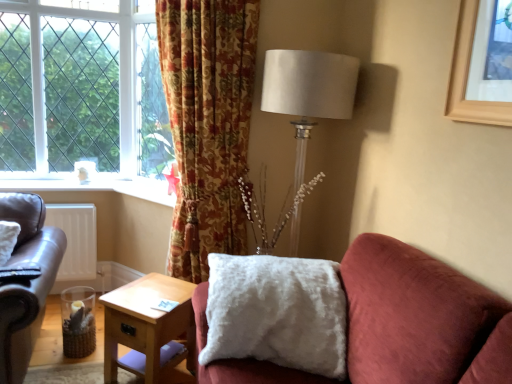
This screenshot has width=512, height=384. Describe the element at coordinates (81, 92) in the screenshot. I see `green leafy tree at left` at that location.

Describe the element at coordinates (26, 282) in the screenshot. I see `leather couch at left` at that location.

Where is `white matte radiator at lower left`? white matte radiator at lower left is located at coordinates (76, 239).

How different are the orientations of white fluffy pillow at center and green leafy tree at left in degrees?

The facing directions of white fluffy pillow at center and green leafy tree at left are 12.9 degrees apart.

Is white fluffy pillow at center facing towards green leafy tree at left?

No, white fluffy pillow at center is not facing towards green leafy tree at left.

Consider the image. From a real-world perspective, is white fluffy pillow at center above or below green leafy tree at left?

In terms of real-world spatial position, white fluffy pillow at center is below green leafy tree at left.

Which is correct: white fluffy pillow at center is inside green leafy tree at left, or outside of it?

The correct answer is: outside.

From the image's perspective, which one is positioned higher, green leafy tree at left or satin white lampshade at upper right?

From the image's view, green leafy tree at left is above.

Is green leafy tree at left bigger or smaller than satin white lampshade at upper right?

Considering their sizes, green leafy tree at left takes up less space than satin white lampshade at upper right.

Is green leafy tree at left wider or thinner than satin white lampshade at upper right?

In the image, green leafy tree at left appears to be more narrow than satin white lampshade at upper right.

Considering the relative positions of light wood/texture side table at lower center and leather couch at left in the image provided, is light wood/texture side table at lower center to the left or to the right of leather couch at left?

light wood/texture side table at lower center is to the right of leather couch at left.

Is light wood/texture side table at lower center smaller than leather couch at left?

Yes, light wood/texture side table at lower center is smaller than leather couch at left.

Can you tell me how much light wood/texture side table at lower center and leather couch at left differ in facing direction?

44.5 degrees.

Which object is closer to the camera taking this photo, light wood/texture side table at lower center or leather couch at left?

leather couch at left.

Does leather couch at left appear on the right side of white matte radiator at lower left?

Correct, you'll find leather couch at left to the right of white matte radiator at lower left.

Could you tell me if leather couch at left is turned towards white matte radiator at lower left?

No, leather couch at left is not turned towards white matte radiator at lower left.

From the picture: Which of these two, leather couch at left or white matte radiator at lower left, is smaller?

white matte radiator at lower left.

Is leather couch at left in front of or behind white matte radiator at lower left in the image?

Clearly, leather couch at left is in front of white matte radiator at lower left.

Is light wood/texture side table at lower center outside of satin white lampshade at upper right?

That's correct, light wood/texture side table at lower center is outside of satin white lampshade at upper right.

Is light wood/texture side table at lower center taller than satin white lampshade at upper right?

Incorrect, the height of light wood/texture side table at lower center is not larger of that of satin white lampshade at upper right.

From the image's perspective, relative to satin white lampshade at upper right, is light wood/texture side table at lower center above or below?

From the image's perspective, light wood/texture side table at lower center appears below satin white lampshade at upper right.

Based on their positions, is wooden picture frame at upper right located to the left or right of green leafy tree at left?

wooden picture frame at upper right is to the right of green leafy tree at left.

Is wooden picture frame at upper right far away from green leafy tree at left?

Absolutely, wooden picture frame at upper right is distant from green leafy tree at left.

Is wooden picture frame at upper right facing towards green leafy tree at left?

No, wooden picture frame at upper right is not turned towards green leafy tree at left.

Based on the photo, is wooden picture frame at upper right wider than green leafy tree at left?

No.

Which object is wider, leather couch at left or wooden picture frame at upper right?

leather couch at left is wider.

Locate an element on the screen. studio couch that is behind the wooden picture frame at upper right is located at coordinates (26, 282).

Consider the image. Is leather couch at left to the right of wooden picture frame at upper right from the viewer's perspective?

Incorrect, leather couch at left is not on the right side of wooden picture frame at upper right.

At what (x,y) coordinates should I click in order to perform the action: click on pillow on the right of green leafy tree at left. Please return your answer as a coordinate pair (x, y). Looking at the image, I should click on (276, 312).

Where is `tree that is above the satin white lampshade at upper right (from the image's perspective)`? The image size is (512, 384). tree that is above the satin white lampshade at upper right (from the image's perspective) is located at coordinates (81, 92).

When comparing their distances from white matte radiator at lower left, does satin white lampshade at upper right or green leafy tree at left seem further?

Based on the image, satin white lampshade at upper right appears to be further to white matte radiator at lower left.

When comparing their distances from light wood/texture side table at lower center, does floral-patterned fabric curtain at upper center or leather couch at left seem further?

floral-patterned fabric curtain at upper center.

Based on their spatial positions, is floral-patterned fabric curtain at upper center or white fluffy pillow at center further from wooden picture frame at upper right?

Among the two, floral-patterned fabric curtain at upper center is located further to wooden picture frame at upper right.

Which object lies further to the anchor point white matte radiator at lower left, white fluffy pillow at center or wooden picture frame at upper right?

wooden picture frame at upper right is further to white matte radiator at lower left.

Looking at the image, which one is located closer to floral-patterned fabric curtain at upper center, leather couch at left or satin white lampshade at upper right?

The object closer to floral-patterned fabric curtain at upper center is satin white lampshade at upper right.

Consider the image. When comparing their distances from leather couch at left, does satin white lampshade at upper right or green leafy tree at left seem closer?

The object closer to leather couch at left is green leafy tree at left.

Based on their spatial positions, is green leafy tree at left or white matte radiator at lower left further from floral-patterned fabric curtain at upper center?

green leafy tree at left is positioned further to the anchor floral-patterned fabric curtain at upper center.

From the image, which object appears to be farther from white fluffy pillow at center, satin white lampshade at upper right or green leafy tree at left?

green leafy tree at left is further to white fluffy pillow at center.

Where is `table lamp between floral-patterned fabric curtain at upper center and wooden picture frame at upper right`? The width and height of the screenshot is (512, 384). table lamp between floral-patterned fabric curtain at upper center and wooden picture frame at upper right is located at coordinates (308, 91).

This screenshot has height=384, width=512. In order to click on table between green leafy tree at left and satin white lampshade at upper right in the horizontal direction in this screenshot , I will do (149, 328).

Find the location of `table located between leather couch at left and white fluffy pillow at center in the left-right direction`. table located between leather couch at left and white fluffy pillow at center in the left-right direction is located at coordinates (149, 328).

This screenshot has width=512, height=384. Find the location of `pillow between white matte radiator at lower left and satin white lampshade at upper right from left to right`. pillow between white matte radiator at lower left and satin white lampshade at upper right from left to right is located at coordinates pyautogui.click(x=276, y=312).